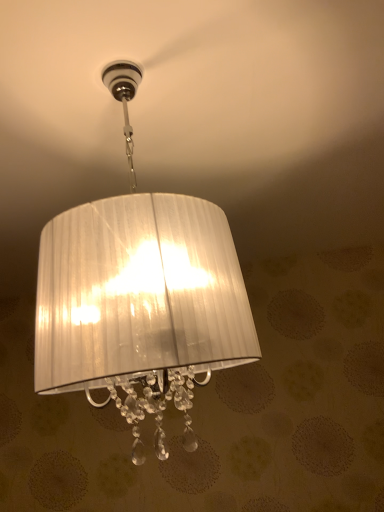
Locate an element on the screen. The width and height of the screenshot is (384, 512). white pleated shade at center is located at coordinates (140, 305).

This screenshot has width=384, height=512. What do you see at coordinates (140, 305) in the screenshot?
I see `white pleated shade at center` at bounding box center [140, 305].

The width and height of the screenshot is (384, 512). What are the coordinates of `white pleated shade at center` in the screenshot? It's located at (140, 305).